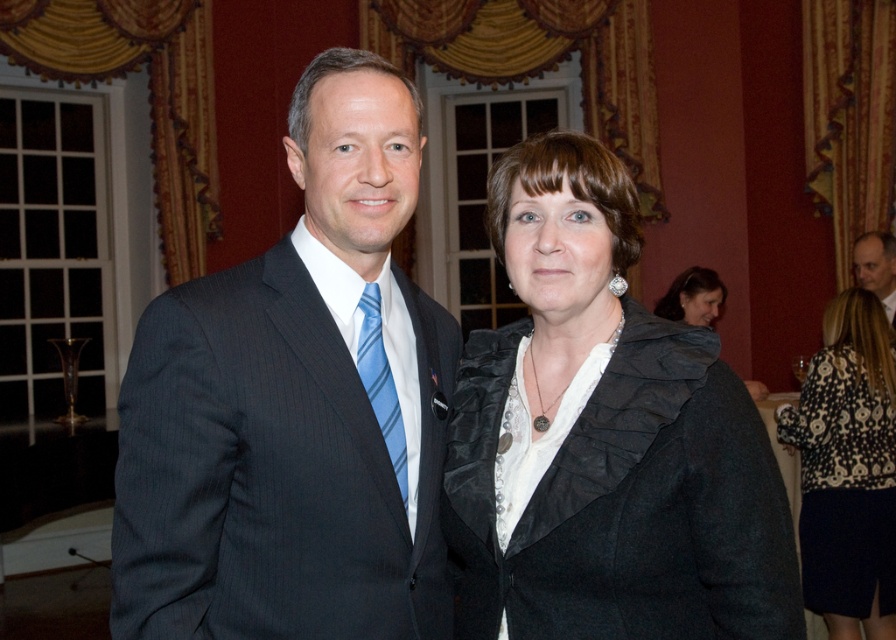
You are a photographer adjusting the lighting for a portrait. You need to ensure that the blue striped tie at center and the matte black jacket at center are both clearly visible. Which object might require additional lighting to avoid appearing too dark?

The matte black jacket at center might require additional lighting because it is thicker than the blue striped tie at center, making it harder to capture details in darker areas.

In the formal indoor setting, you notice the blue striped tie at center and the matte black jacket at center. Which object is positioned to the left of the other?

The blue striped tie at center is to the left of the matte black jacket at center.